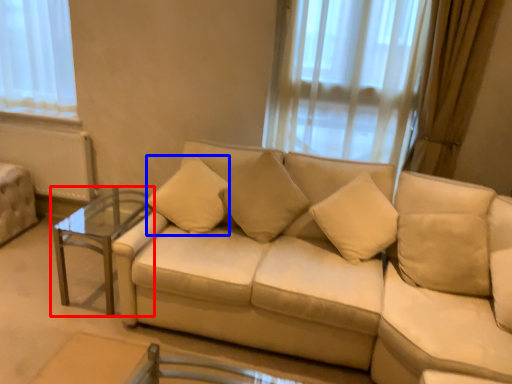
Question: Which point is further to the camera, table (highlighted by a red box) or pillow (highlighted by a blue box)?

Choices:
 (A) table
 (B) pillow

Answer: (B)